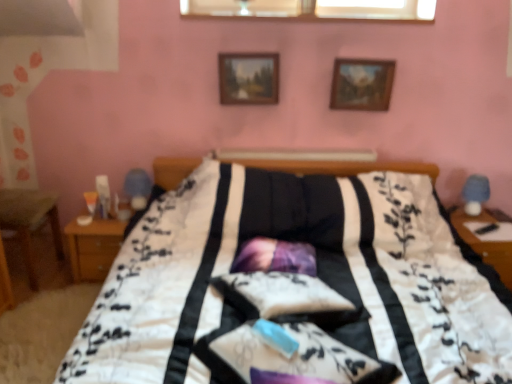
Question: From a real-world perspective, is transparent glass window at upper center beneath purple satin pillow at center?

Choices:
 (A) yes
 (B) no

Answer: (B)

Question: Can you confirm if transparent glass window at upper center is thinner than purple satin pillow at center?

Choices:
 (A) yes
 (B) no

Answer: (A)

Question: Does transparent glass window at upper center have a smaller size compared to purple satin pillow at center?

Choices:
 (A) yes
 (B) no

Answer: (A)

Question: Is transparent glass window at upper center facing away from purple satin pillow at center?

Choices:
 (A) no
 (B) yes

Answer: (A)

Question: Does transparent glass window at upper center have a greater height compared to purple satin pillow at center?

Choices:
 (A) no
 (B) yes

Answer: (A)

Question: Considering their positions, is wooden nightstand at left located in front of or behind purple satin pillow at center?

Choices:
 (A) behind
 (B) front

Answer: (A)

Question: Is wooden nightstand at left taller or shorter than purple satin pillow at center?

Choices:
 (A) tall
 (B) short

Answer: (A)

Question: From the image's perspective, is wooden nightstand at left above or below purple satin pillow at center?

Choices:
 (A) below
 (B) above

Answer: (A)

Question: From a real-world perspective, is wooden nightstand at left positioned above or below purple satin pillow at center?

Choices:
 (A) below
 (B) above

Answer: (A)

Question: From a real-world perspective, is wooden picture frame at upper center, the second picture frame when ordered from right to left, above or below wooden nightstand at left?

Choices:
 (A) below
 (B) above

Answer: (B)

Question: Considering the positions of point (253, 72) and point (109, 243), is point (253, 72) closer or farther from the camera than point (109, 243)?

Choices:
 (A) closer
 (B) farther

Answer: (B)

Question: Based on their sizes in the image, would you say wooden picture frame at upper center, the second picture frame when ordered from right to left, is bigger or smaller than wooden nightstand at left?

Choices:
 (A) small
 (B) big

Answer: (A)

Question: Which is correct: wooden picture frame at upper center, which is counted as the 1th picture frame, starting from the left, is inside wooden nightstand at left, or outside of it?

Choices:
 (A) inside
 (B) outside

Answer: (B)

Question: Is wooden nightstand at left bigger or smaller than transparent glass window at upper center?

Choices:
 (A) small
 (B) big

Answer: (B)

Question: Considering the positions of wooden nightstand at left and transparent glass window at upper center in the image, is wooden nightstand at left wider or thinner than transparent glass window at upper center?

Choices:
 (A) thin
 (B) wide

Answer: (B)